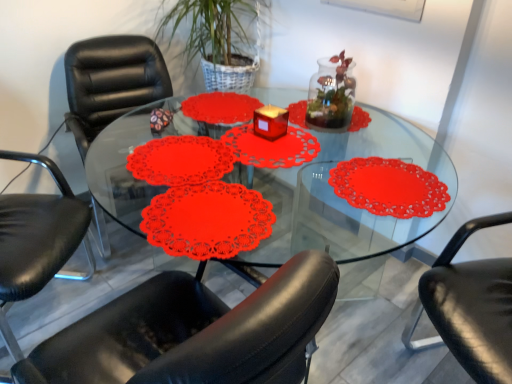
Locate an element on the screen. transparent glass table at center is located at coordinates tap(345, 199).

What do you see at coordinates (111, 82) in the screenshot? I see `black leather chair at left, the second chair positioned from the right` at bounding box center [111, 82].

From the picture: How much space does black leather chair at lower right, which is counted as the first chair, starting from the right, occupy horizontally?

25.85 inches.

Where is `transparent glass terrarium at center`? This screenshot has width=512, height=384. transparent glass terrarium at center is located at coordinates (331, 94).

At what (x,y) coordinates should I click in order to perform the action: click on transparent glass table at center. Please return your answer as a coordinate pair (x, y). The image size is (512, 384). Looking at the image, I should click on (345, 199).

From a real-world perspective, which is physically above, black leather chair at lower right, which is counted as the first chair, starting from the right, or matte red candle at center?

From a 3D spatial view, matte red candle at center is above.

Is matte red candle at center at the back of black leather chair at lower right, which is counted as the first chair, starting from the right?

black leather chair at lower right, which is counted as the first chair, starting from the right, is not turned away from matte red candle at center.

Considering the sizes of objects black leather chair at lower right, which is counted as the first chair, starting from the right, and matte red candle at center in the image provided, who is taller, black leather chair at lower right, which is counted as the first chair, starting from the right, or matte red candle at center?

black leather chair at lower right, which is counted as the first chair, starting from the right.

Who is bigger, transparent glass table at center or transparent glass terrarium at center?

transparent glass table at center is bigger.

In the image, is transparent glass table at center positioned in front of or behind transparent glass terrarium at center?

transparent glass table at center is positioned closer to the viewer than transparent glass terrarium at center.

From the picture: Are transparent glass table at center and transparent glass terrarium at center far apart?

transparent glass table at center is actually quite close to transparent glass terrarium at center.

Considering the positions of objects transparent glass table at center and transparent glass terrarium at center in the image provided, who is more to the right, transparent glass table at center or transparent glass terrarium at center?

Positioned to the right is transparent glass terrarium at center.

Can you tell me how much transparent glass table at center and black leather chair at left, which is the third chair from right to left, differ in facing direction?

37.7 degrees separate the facing orientations of transparent glass table at center and black leather chair at left, which is the third chair from right to left.

Based on their sizes in the image, would you say transparent glass table at center is bigger or smaller than black leather chair at left, which is the third chair from right to left?

Clearly, transparent glass table at center is larger in size than black leather chair at left, which is the third chair from right to left.

Which of these two, transparent glass table at center or black leather chair at left, which is the third chair from right to left, is thinner?

black leather chair at left, which is the third chair from right to left, is thinner.

At what (x,y) coordinates should I click in order to perform the action: click on the 2nd chair to the left of the transparent glass table at center, counting from the anchor's position. Please return your answer as a coordinate pair (x, y). The width and height of the screenshot is (512, 384). Looking at the image, I should click on (38, 240).

Looking at this image, is transparent glass terrarium at center behind matte red candle at center?

No.

Looking at this image, is transparent glass terrarium at center completely or partially outside of matte red candle at center?

Absolutely, transparent glass terrarium at center is external to matte red candle at center.

Is transparent glass terrarium at center smaller than matte red candle at center?

Incorrect, transparent glass terrarium at center is not smaller in size than matte red candle at center.

Is matte red candle at center at the back of transparent glass terrarium at center?

No, transparent glass terrarium at center is not facing the opposite direction of matte red candle at center.

Does transparent glass terrarium at center have a larger size compared to black leather chair at left, the second chair positioned from the right?

No, transparent glass terrarium at center is not bigger than black leather chair at left, the second chair positioned from the right.

Is transparent glass terrarium at center oriented towards black leather chair at left, the second chair when ordered from left to right?

No, transparent glass terrarium at center is not oriented towards black leather chair at left, the second chair when ordered from left to right.

In the scene shown: Do you think transparent glass terrarium at center is within black leather chair at left, the second chair positioned from the right, or outside of it?

transparent glass terrarium at center lies outside black leather chair at left, the second chair positioned from the right.

From the picture: Considering the sizes of objects transparent glass terrarium at center and black leather chair at left, the second chair when ordered from left to right, in the image provided, who is thinner, transparent glass terrarium at center or black leather chair at left, the second chair when ordered from left to right,?

Thinner between the two is transparent glass terrarium at center.

Looking at this image, which object is positioned more to the left, black leather chair at left, which is the third chair from right to left, or black leather chair at left, the second chair positioned from the right?

From the viewer's perspective, black leather chair at left, which is the third chair from right to left, appears more on the left side.

Does black leather chair at left, which is counted as the first chair, starting from the left, have a greater height compared to black leather chair at left, the second chair positioned from the right?

Yes, black leather chair at left, which is counted as the first chair, starting from the left, is taller than black leather chair at left, the second chair positioned from the right.

Considering their positions, is black leather chair at left, which is counted as the first chair, starting from the left, located in front of or behind black leather chair at left, the second chair when ordered from left to right?

In the image, black leather chair at left, which is counted as the first chair, starting from the left, appears in front of black leather chair at left, the second chair when ordered from left to right.

From the image's perspective, between transparent glass table at center and matte red candle at center, which one is located above?

matte red candle at center is shown above in the image.

From a real-world perspective, between transparent glass table at center and matte red candle at center, who is vertically lower?

From a 3D spatial view, transparent glass table at center is below.

Is transparent glass table at center at the left side of matte red candle at center?

Correct, you'll find transparent glass table at center to the left of matte red candle at center.

Measure the distance from transparent glass table at center to matte red candle at center.

59.80 centimeters.

Locate an element on the screen. Image resolution: width=512 pixels, height=384 pixels. chair that is on the right side of matte red candle at center is located at coordinates (470, 307).

Locate an element on the screen. The height and width of the screenshot is (384, 512). table on the left of transparent glass terrarium at center is located at coordinates (345, 199).

From the image, which object appears to be nearer to black leather chair at left, the second chair when ordered from left to right, transparent glass terrarium at center or matte red candle at center?

The object closer to black leather chair at left, the second chair when ordered from left to right, is matte red candle at center.

Based on their spatial positions, is matte red candle at center or black leather chair at lower right, the 3th chair when ordered from left to right, further from transparent glass table at center?

Based on the image, black leather chair at lower right, the 3th chair when ordered from left to right, appears to be further to transparent glass table at center.

When comparing their distances from black leather chair at lower right, the 3th chair when ordered from left to right, does black leather chair at left, which is the third chair from right to left, or transparent glass terrarium at center seem closer?

The object closer to black leather chair at lower right, the 3th chair when ordered from left to right, is transparent glass terrarium at center.

When comparing their distances from matte red candle at center, does black leather chair at left, which is counted as the first chair, starting from the left, or transparent glass table at center seem closer?

transparent glass table at center is positioned closer to the anchor matte red candle at center.

From the image, which object appears to be farther from black leather chair at lower right, which is counted as the first chair, starting from the right, transparent glass table at center or black leather chair at left, the second chair positioned from the right?

Based on the image, black leather chair at left, the second chair positioned from the right, appears to be further to black leather chair at lower right, which is counted as the first chair, starting from the right.

Which object lies further to the anchor point transparent glass terrarium at center, transparent glass table at center or black leather chair at left, the second chair when ordered from left to right?

Among the two, black leather chair at left, the second chair when ordered from left to right, is located further to transparent glass terrarium at center.

Estimate the real-world distances between objects in this image. Which object is closer to transparent glass table at center, transparent glass terrarium at center or matte red candle at center?

transparent glass terrarium at center.

Which object lies further to the anchor point black leather chair at left, which is the third chair from right to left, black leather chair at lower right, which is counted as the first chair, starting from the right, or black leather chair at left, the second chair positioned from the right?

Among the two, black leather chair at lower right, which is counted as the first chair, starting from the right, is located further to black leather chair at left, which is the third chair from right to left.

Image resolution: width=512 pixels, height=384 pixels. In order to click on chair between black leather chair at left, which is counted as the first chair, starting from the left, and matte red candle at center in this screenshot , I will do [111, 82].

Find the location of a particular element. The width and height of the screenshot is (512, 384). table situated between black leather chair at left, which is the third chair from right to left, and matte red candle at center from left to right is located at coordinates (345, 199).

The width and height of the screenshot is (512, 384). I want to click on glass vase between black leather chair at lower right, which is counted as the first chair, starting from the right, and matte red candle at center, along the z-axis, so click(331, 94).

Image resolution: width=512 pixels, height=384 pixels. Find the location of `table between black leather chair at left, which is counted as the first chair, starting from the left, and transparent glass terrarium at center from left to right`. table between black leather chair at left, which is counted as the first chair, starting from the left, and transparent glass terrarium at center from left to right is located at coordinates (345, 199).